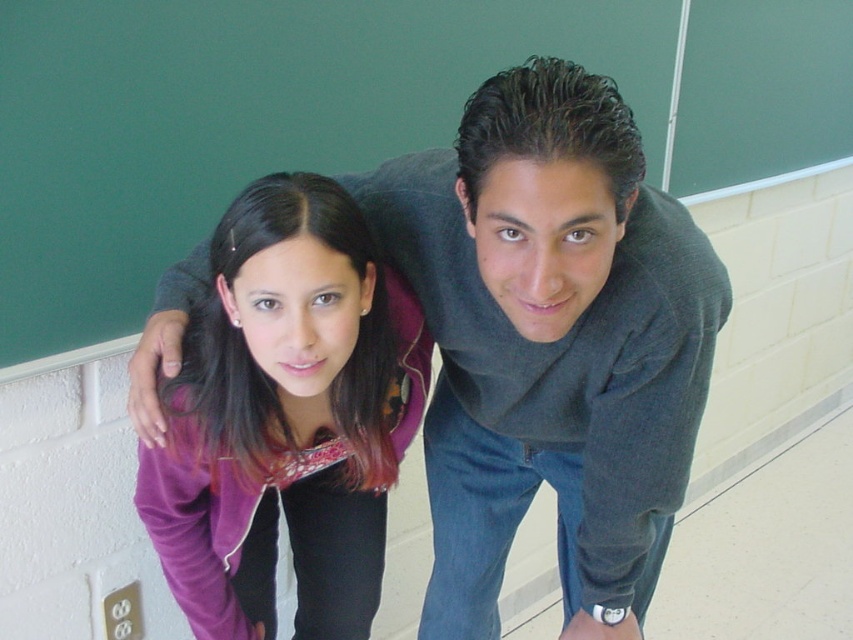
You are a painter who needs to hang a 1.2 meter wide canvas. You see the green chalkboard at upper center and the matte gray sweater at center. Which object has enough width to accommodate the canvas without overlapping?

The green chalkboard at upper center has a greater width than the matte gray sweater at center. Since the canvas is 1.2 meters wide, you should check the chalkboard first to see if its width is sufficient. If the chalkboard is wider than 1.2 meters, it can accommodate the canvas without overlapping.

You are a photographer setting up a shoot in a school hallway. You notice two clothing items in the scene. The matte gray sweater at center and the purple fleece jacket at center. Which clothing item is positioned higher in the image?

The matte gray sweater at center is located above the purple fleece jacket at center, so it is positioned higher in the image.

You are a student who wants to write a note on the green chalkboard at upper center but you are currently standing near the matte gray sweater at center. Do you need to move closer to the chalkboard?

The green chalkboard at upper center is larger in size than the matte gray sweater at center, so you would need to move closer to reach it since the chalkboard is bigger and farther away.